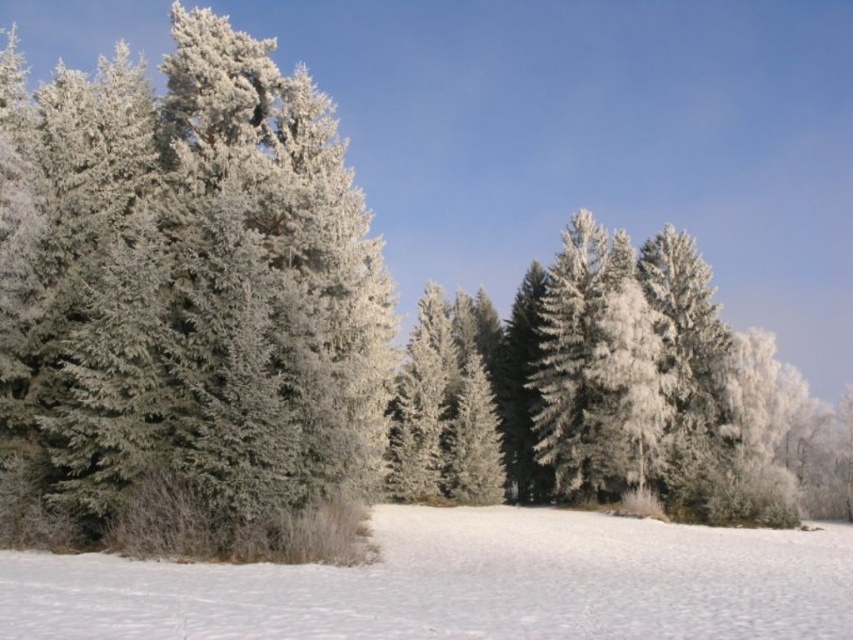
Does point (340, 179) come in front of point (575, 330)?

Yes, it is in front of point (575, 330).

Which is in front, point (222, 452) or point (550, 499)?

Point (222, 452) is in front.

Locate an element on the screen. This screenshot has height=640, width=853. frosted pine tree at left is located at coordinates (190, 305).

Describe the element at coordinates (619, 397) in the screenshot. The height and width of the screenshot is (640, 853). I see `frosted pine trees at center` at that location.

Who is taller, frosted pine trees at center or white fluffy snow at lower center?

Standing taller between the two is frosted pine trees at center.

The height and width of the screenshot is (640, 853). What are the coordinates of `frosted pine trees at center` in the screenshot? It's located at coord(619,397).

Is point (41, 353) positioned after point (602, 625)?

Yes, it is.

Does frosted pine tree at left have a smaller size compared to white fluffy snow at lower center?

Actually, frosted pine tree at left might be larger than white fluffy snow at lower center.

Does point (123, 67) come behind point (839, 579)?

Yes, point (123, 67) is farther from viewer.

Find the location of `frosted pine tree at left`. frosted pine tree at left is located at coordinates click(x=190, y=305).